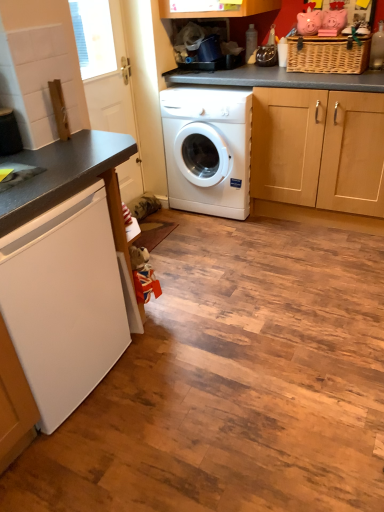
Question: Is white matte refrigerator at lower left, arranged as the first washing machine when ordered from the bottom, at the back of white glossy washing machine at center, which ranks as the 2th washing machine in bottom-to-top order?

Choices:
 (A) no
 (B) yes

Answer: (A)

Question: Is white glossy washing machine at center, the 1th washing machine from the right, next to white matte refrigerator at lower left, acting as the first washing machine starting from the left, and touching it?

Choices:
 (A) yes
 (B) no

Answer: (B)

Question: Is white glossy washing machine at center, arranged as the 1th washing machine when viewed from the top, oriented towards white matte refrigerator at lower left, acting as the 1th washing machine starting from the front?

Choices:
 (A) no
 (B) yes

Answer: (B)

Question: From a real-world perspective, is white glossy washing machine at center, arranged as the 1th washing machine when viewed from the top, beneath white matte refrigerator at lower left, acting as the first washing machine starting from the left?

Choices:
 (A) yes
 (B) no

Answer: (B)

Question: Is white glossy washing machine at center, which ranks as the 2th washing machine in bottom-to-top order, positioned before white matte refrigerator at lower left, the second washing machine viewed from the right?

Choices:
 (A) yes
 (B) no

Answer: (B)

Question: Considering their positions, is white glossy washing machine at center, the 1th washing machine from the right, located in front of or behind woven brown basket at upper right?

Choices:
 (A) front
 (B) behind

Answer: (B)

Question: Would you say white glossy washing machine at center, marked as the 1th washing machine in a back-to-front arrangement, is inside or outside woven brown basket at upper right?

Choices:
 (A) outside
 (B) inside

Answer: (A)

Question: From the image's perspective, is white glossy washing machine at center, arranged as the 1th washing machine when viewed from the top, located above or below woven brown basket at upper right?

Choices:
 (A) below
 (B) above

Answer: (A)

Question: Considering the positions of point (200, 180) and point (349, 68), is point (200, 180) closer or farther from the camera than point (349, 68)?

Choices:
 (A) farther
 (B) closer

Answer: (A)

Question: From a real-world perspective, is white matte refrigerator at lower left, the second washing machine viewed from the right, above or below woven brown basket at upper right?

Choices:
 (A) above
 (B) below

Answer: (B)

Question: Is point (109, 225) closer or farther from the camera than point (322, 61)?

Choices:
 (A) closer
 (B) farther

Answer: (A)

Question: Visually, is white matte refrigerator at lower left, acting as the 1th washing machine starting from the front, positioned to the left or to the right of woven brown basket at upper right?

Choices:
 (A) right
 (B) left

Answer: (B)

Question: Considering the positions of white matte refrigerator at lower left, acting as the 1th washing machine starting from the front, and woven brown basket at upper right in the image, is white matte refrigerator at lower left, acting as the 1th washing machine starting from the front, taller or shorter than woven brown basket at upper right?

Choices:
 (A) tall
 (B) short

Answer: (A)

Question: Is white glossy door at upper left situated inside woven brown basket at upper right or outside?

Choices:
 (A) inside
 (B) outside

Answer: (B)

Question: Is white glossy door at upper left taller or shorter than woven brown basket at upper right?

Choices:
 (A) tall
 (B) short

Answer: (A)